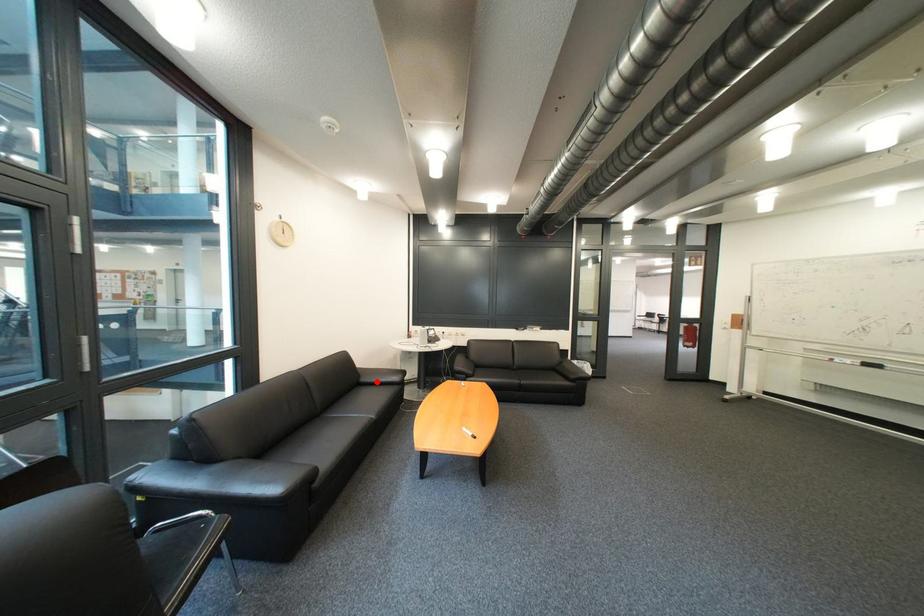
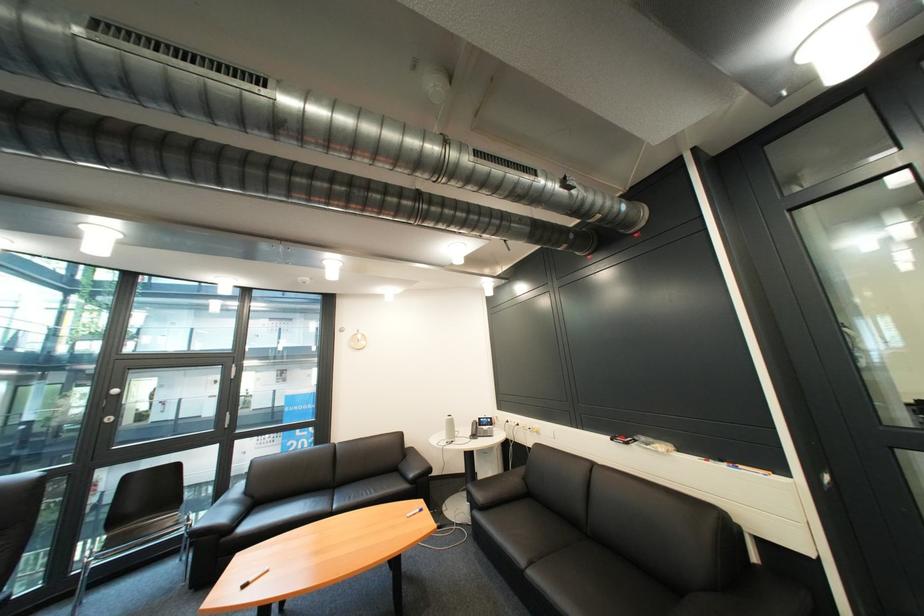
Find the pixel in the second image that matches the highlighted location in the first image.

(414, 468)